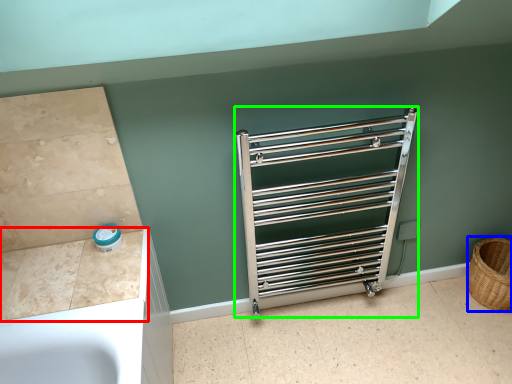
Question: Based on their relative distances, which object is nearer to counter top (highlighted by a red box)? Choose from basket (highlighted by a blue box) and cage (highlighted by a green box).

Choices:
 (A) basket
 (B) cage

Answer: (B)